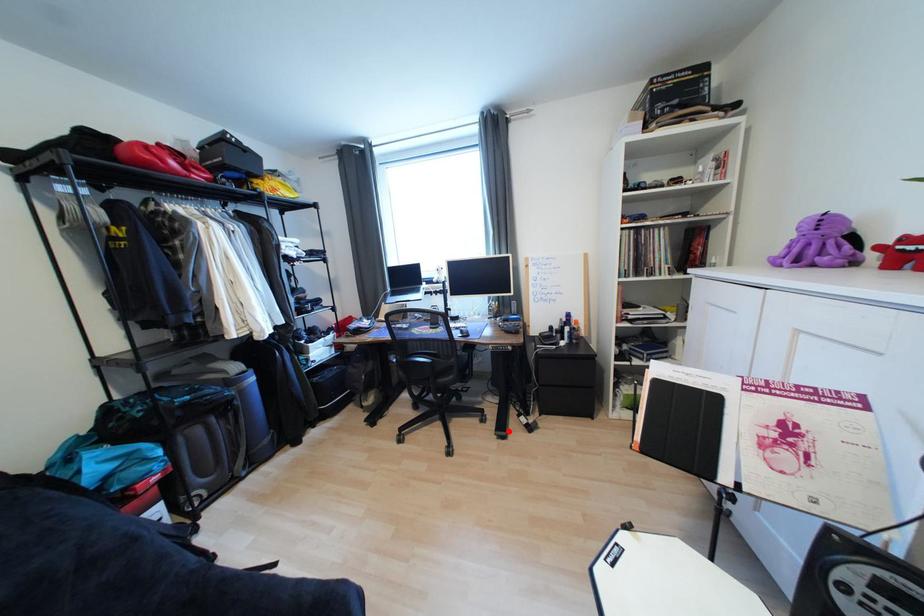
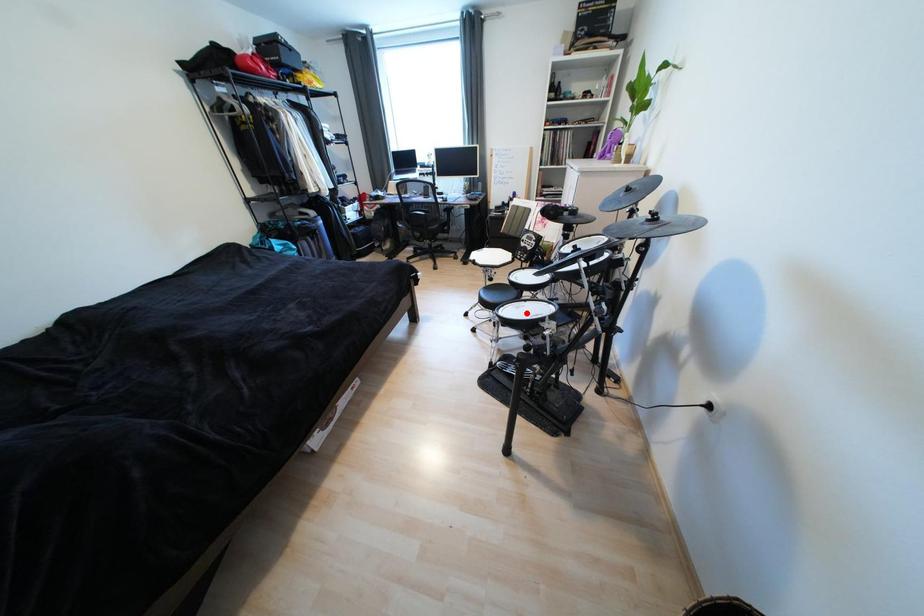
I am providing you with two images of the same scene from different viewpoints. A red point is marked on the first image and another point is marked on the second image. Is the red point in image1 aligned with the point shown in image2?

No